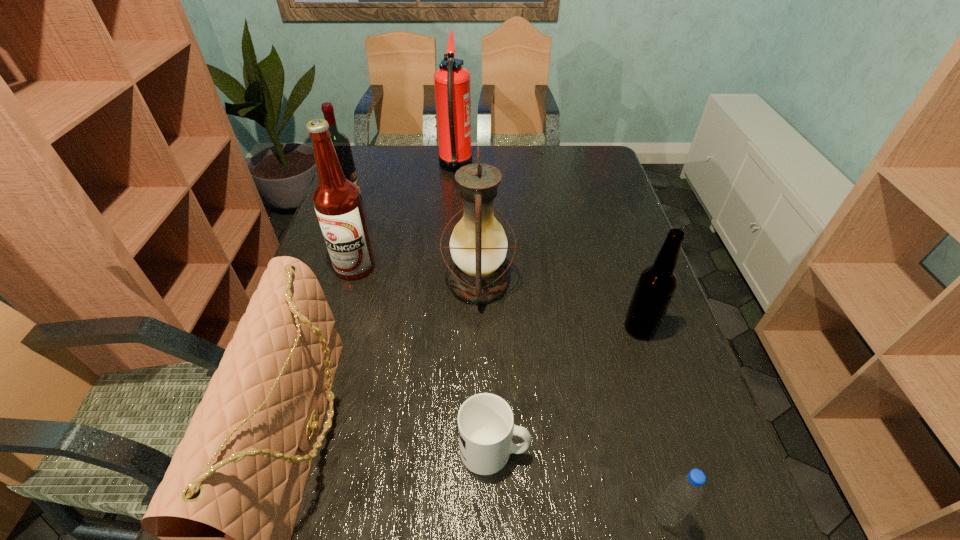
I want to click on vacant space at the far edge, so click(481, 151).

Locate an element on the screen. The width and height of the screenshot is (960, 540). vacant space at the left edge of the desktop is located at coordinates (382, 195).

Where is `vacant space at the right edge`? vacant space at the right edge is located at coordinates (611, 324).

Locate an element on the screen. This screenshot has width=960, height=540. free space between the farthest object and the beer bottle is located at coordinates (547, 248).

You are a GUI agent. You are given a task and a screenshot of the screen. Output one action in this format:
    pyautogui.click(x=<x>, y=<y>)
    Task: Click on the vacant region between the farthest object and the shortest object
    The height and width of the screenshot is (540, 960).
    Given the screenshot: What is the action you would take?
    pyautogui.click(x=474, y=308)

You are a GUI agent. You are given a task and a screenshot of the screen. Output one action in this format:
    pyautogui.click(x=<x>, y=<y>)
    Task: Click on the vacant area that lies between the water bottle and the oil lamp
    
    Given the screenshot: What is the action you would take?
    pyautogui.click(x=572, y=400)

Find the location of a particular element. The width and height of the screenshot is (960, 540). the fifth closest object to the mug is located at coordinates (337, 201).

Image resolution: width=960 pixels, height=540 pixels. I want to click on object that ranks as the fifth closest to the shortest object, so click(x=337, y=201).

Find the location of a particular element. free location that satisfies the following two spatial constraints: 1. at the nozzle of the oil lamp; 2. on the left side of the farthest object is located at coordinates point(446,284).